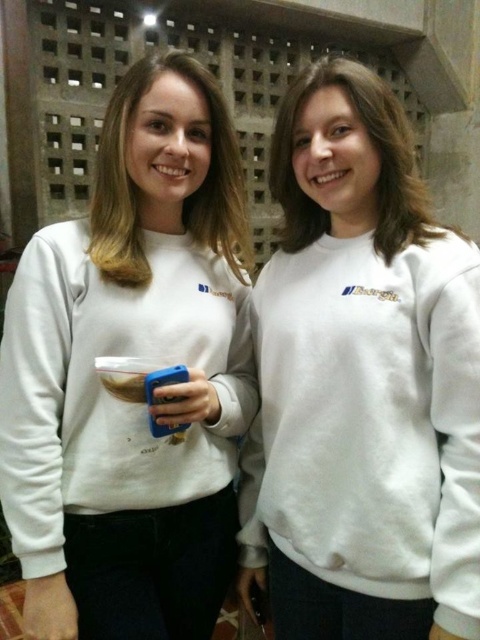
You are taking a photo of two people in a room. You notice two points in the image at coordinates point (444, 604) and point (27, 588). Which point is closer to the camera?

Point (444, 604) is closer to the camera than point (27, 588).

You are a photographer trying to capture a clear shot of the white fleece sweatshirt at center. Given that the camera is focused at point (361, 381), will the sweatshirt be in focus?

The white fleece sweatshirt at center is represented by point (361, 381), so yes, the sweatshirt will be in focus since the camera is focused at that exact point.

You are a fashion designer observing two white sweatshirts in the image. The first is labeled as a white fleece sweatshirt at center, and the second is a white matte sweatshirt at center. Which one is shorter?

The white fleece sweatshirt at center is shorter than the white matte sweatshirt at center.